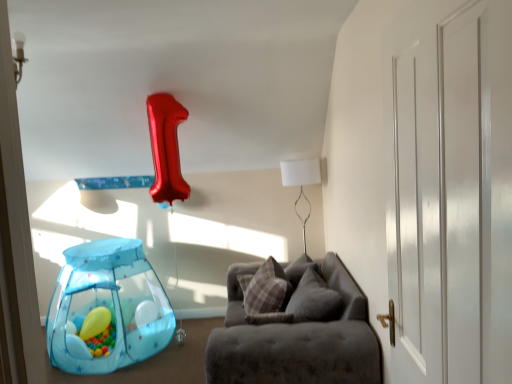
Question: Should I look upward or downward to see translucent blue mesh tent at lower left, the second balloon viewed from the left?

Choices:
 (A) up
 (B) down

Answer: (B)

Question: Is white matte table lamp at upper center not inside translucent blue mesh tent at lower left, the second balloon viewed from the left?

Choices:
 (A) yes
 (B) no

Answer: (A)

Question: Can you confirm if white matte table lamp at upper center is bigger than translucent blue mesh tent at lower left, the first balloon in the right-to-left sequence?

Choices:
 (A) yes
 (B) no

Answer: (B)

Question: Does white matte table lamp at upper center contain translucent blue mesh tent at lower left, the second balloon viewed from the left?

Choices:
 (A) yes
 (B) no

Answer: (B)

Question: Is white matte table lamp at upper center thinner than translucent blue mesh tent at lower left, the second balloon viewed from the left?

Choices:
 (A) yes
 (B) no

Answer: (A)

Question: From a real-world perspective, is white matte table lamp at upper center on top of translucent blue mesh tent at lower left, the first balloon in the right-to-left sequence?

Choices:
 (A) yes
 (B) no

Answer: (A)

Question: Is white matte table lamp at upper center facing towards translucent blue mesh tent at lower left, the first balloon in the right-to-left sequence?

Choices:
 (A) no
 (B) yes

Answer: (A)

Question: Is translucent blue mesh tent at lower left, the second balloon viewed from the left, smaller than white glossy door at right?

Choices:
 (A) no
 (B) yes

Answer: (A)

Question: Is there a large distance between translucent blue mesh tent at lower left, the second balloon viewed from the left, and white glossy door at right?

Choices:
 (A) no
 (B) yes

Answer: (B)

Question: From a real-world perspective, is translucent blue mesh tent at lower left, the first balloon in the right-to-left sequence, on white glossy door at right?

Choices:
 (A) no
 (B) yes

Answer: (A)

Question: Is translucent blue mesh tent at lower left, the first balloon in the right-to-left sequence, shorter than white glossy door at right?

Choices:
 (A) yes
 (B) no

Answer: (A)

Question: Does translucent blue mesh tent at lower left, the first balloon in the right-to-left sequence, lie behind white glossy door at right?

Choices:
 (A) yes
 (B) no

Answer: (A)

Question: Is the surface of translucent blue mesh tent at lower left, the first balloon in the right-to-left sequence, in direct contact with white glossy door at right?

Choices:
 (A) no
 (B) yes

Answer: (A)

Question: Can you see plaid fabric pillow at center touching matte yellow balloon at lower left, which ranks as the second balloon in right-to-left order?

Choices:
 (A) yes
 (B) no

Answer: (B)